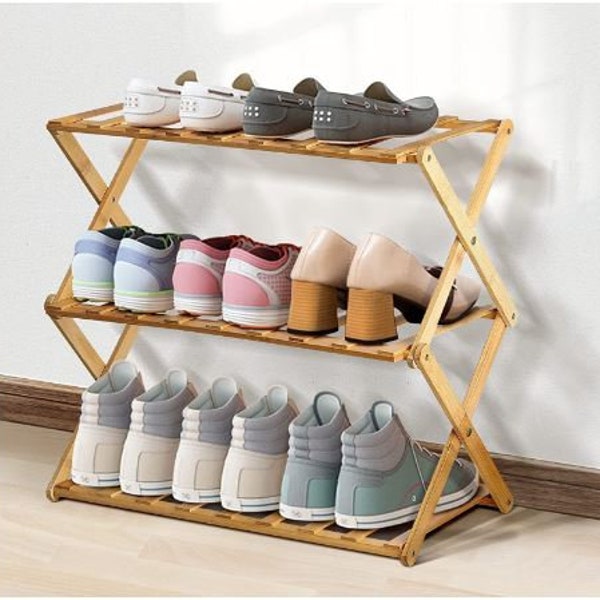
Find the location of a particular element. The height and width of the screenshot is (600, 600). side pieces for shelf is located at coordinates (439, 475), (452, 409), (450, 264), (444, 180), (79, 148), (120, 185), (84, 348), (127, 336).